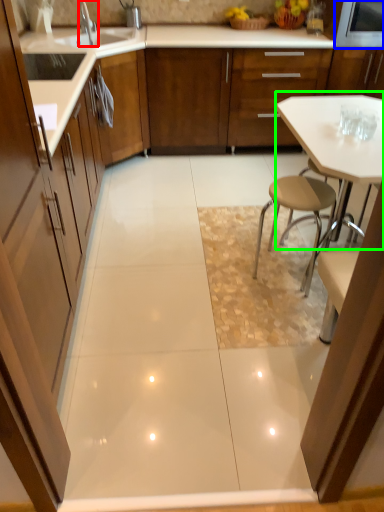
Question: Which is farther away from tap (highlighted by a red box)? appliance (highlighted by a blue box) or table (highlighted by a green box)?

Choices:
 (A) appliance
 (B) table

Answer: (A)